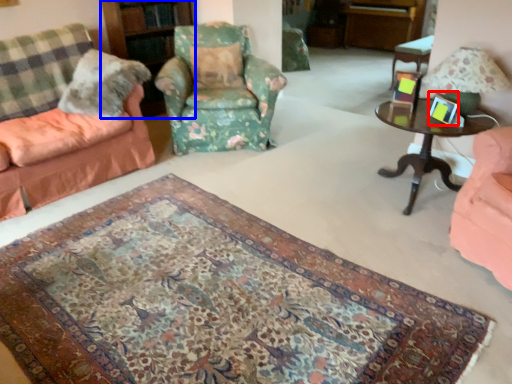
Question: Which of the following is the farthest to the observer, picture frame (highlighted by a red box) or bookshelf (highlighted by a blue box)?

Choices:
 (A) picture frame
 (B) bookshelf

Answer: (B)